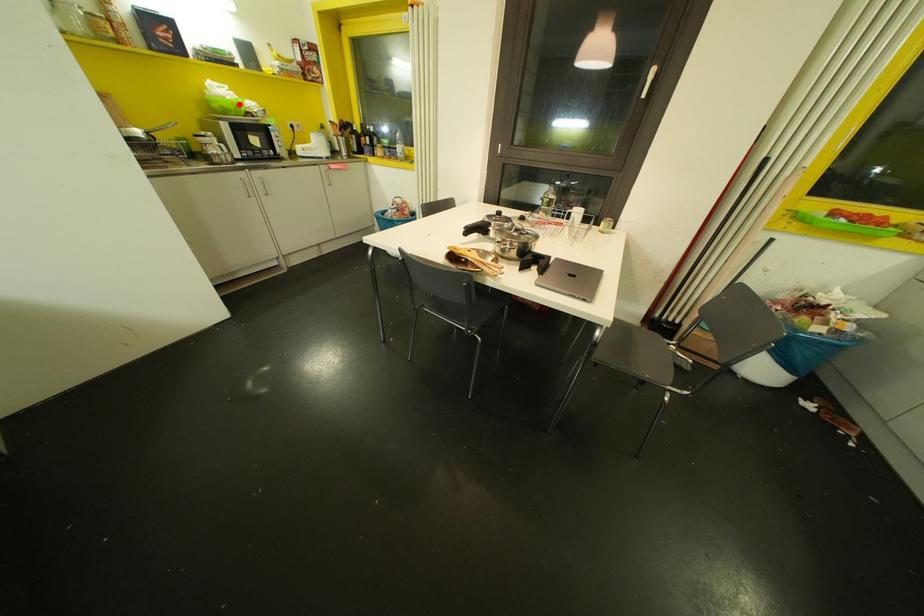
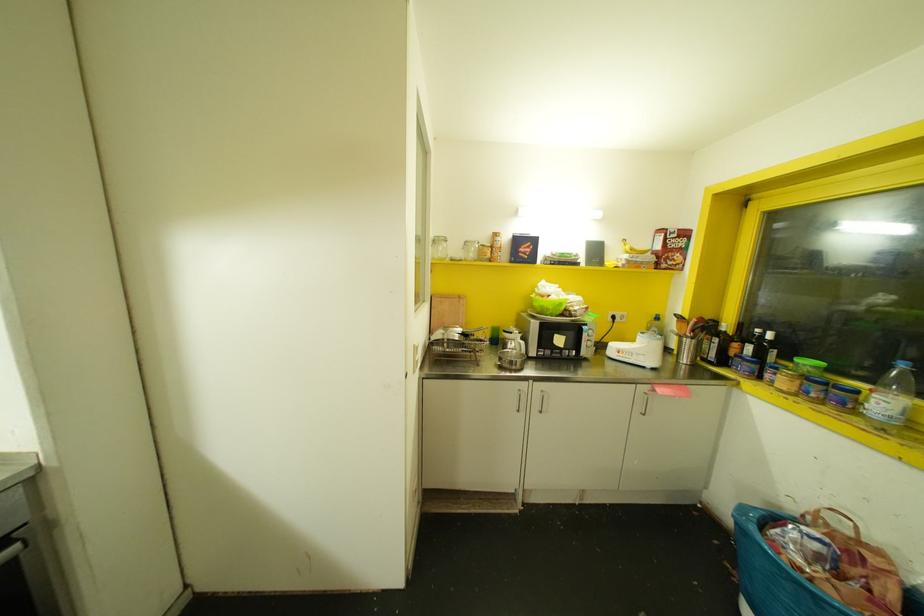
In the second image, find the point that corresponds to the highlighted location in the first image.

(560, 304)